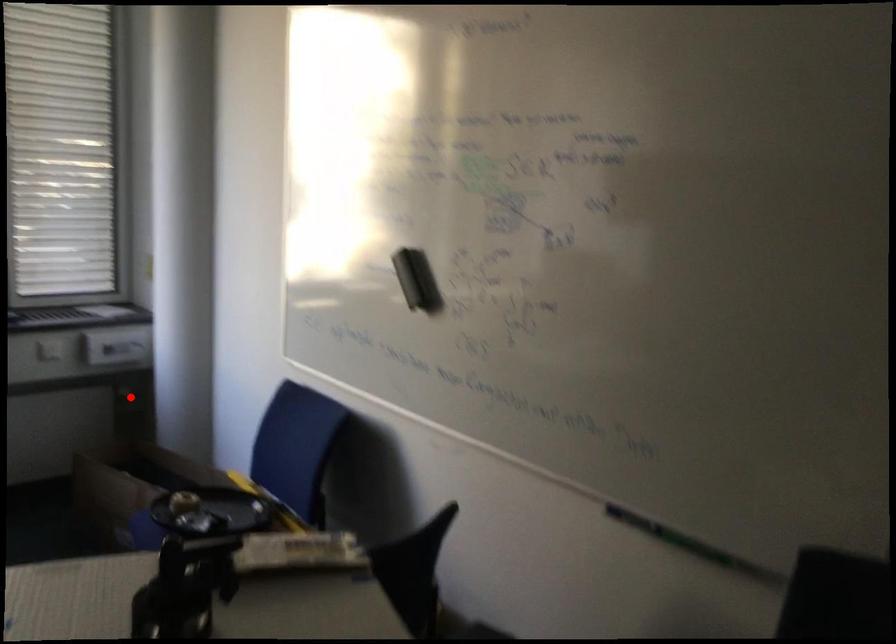
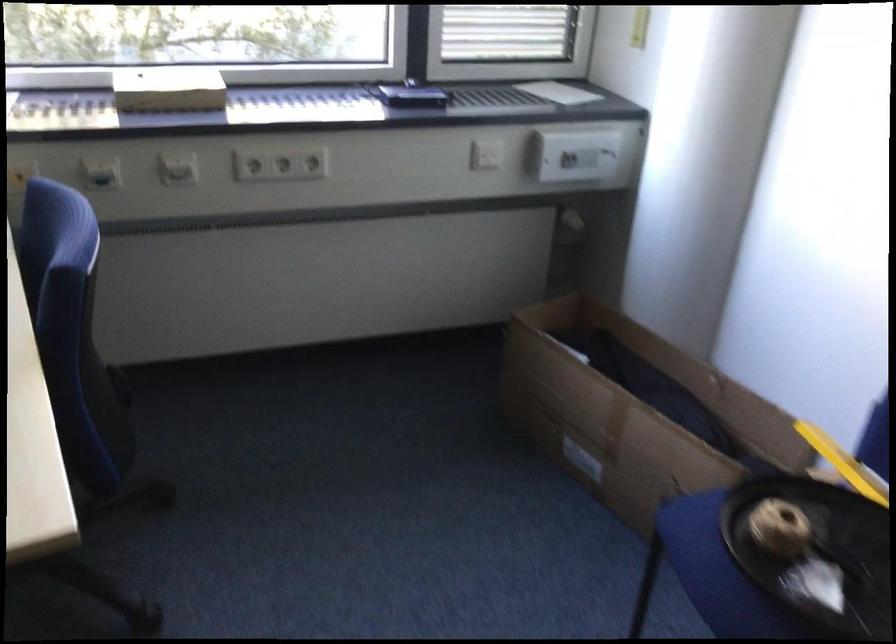
Question: I am providing you with two images of the same scene from different viewpoints. Given a red point in image1, look at the same physical point in image2. Is it:

Choices:
 (A) Closer to the viewpoint
 (B) Farther from the viewpoint

Answer: (A)